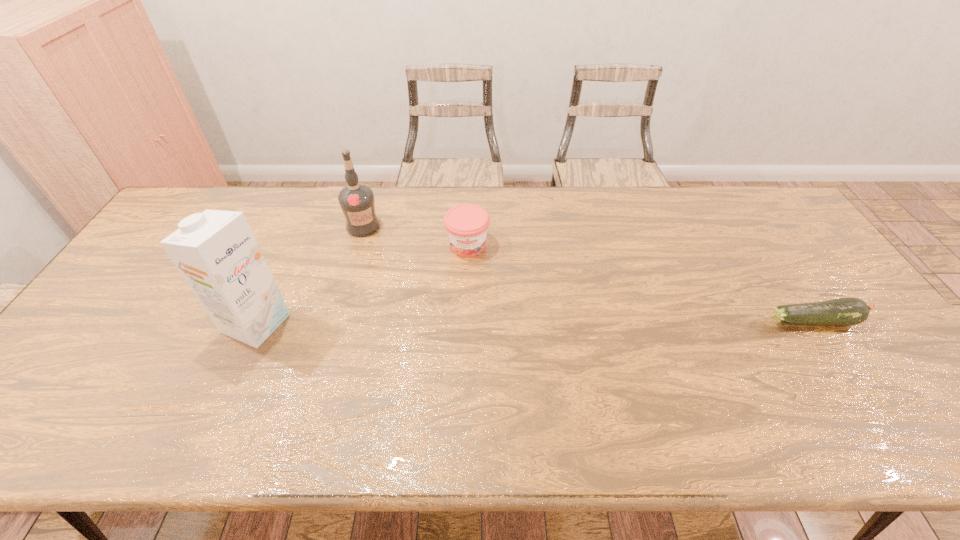
You are a GUI agent. You are given a task and a screenshot of the screen. Output one action in this format:
    pyautogui.click(x=<x>, y=<y>)
    Task: Click on the tallest object
    The height and width of the screenshot is (540, 960).
    Given the screenshot: What is the action you would take?
    coord(215,251)

You are a GUI agent. You are given a task and a screenshot of the screen. Output one action in this format:
    pyautogui.click(x=<x>, y=<y>)
    Task: Click on the carton
    
    Given the screenshot: What is the action you would take?
    pyautogui.click(x=215, y=251)

At what (x,y) coordinates should I click in order to perform the action: click on zucchini. Please return your answer as a coordinate pair (x, y). This screenshot has width=960, height=540. Looking at the image, I should click on (848, 311).

At what (x,y) coordinates should I click in order to perform the action: click on the shortest object. Please return your answer as a coordinate pair (x, y). Looking at the image, I should click on (848, 311).

This screenshot has width=960, height=540. I want to click on jam, so click(466, 225).

The width and height of the screenshot is (960, 540). Identify the location of the second object from right to left. pos(466,225).

Find the location of a particular element. Image resolution: width=960 pixels, height=540 pixels. the second object from left to right is located at coordinates (356, 200).

At what (x,y) coordinates should I click in order to perform the action: click on the third shortest object. Please return your answer as a coordinate pair (x, y). This screenshot has width=960, height=540. Looking at the image, I should click on (356, 200).

This screenshot has height=540, width=960. I want to click on blank space located on the left of the carton, so click(119, 323).

Find the location of `free space located 0.190m on the front label of the third tallest object`. free space located 0.190m on the front label of the third tallest object is located at coordinates (474, 309).